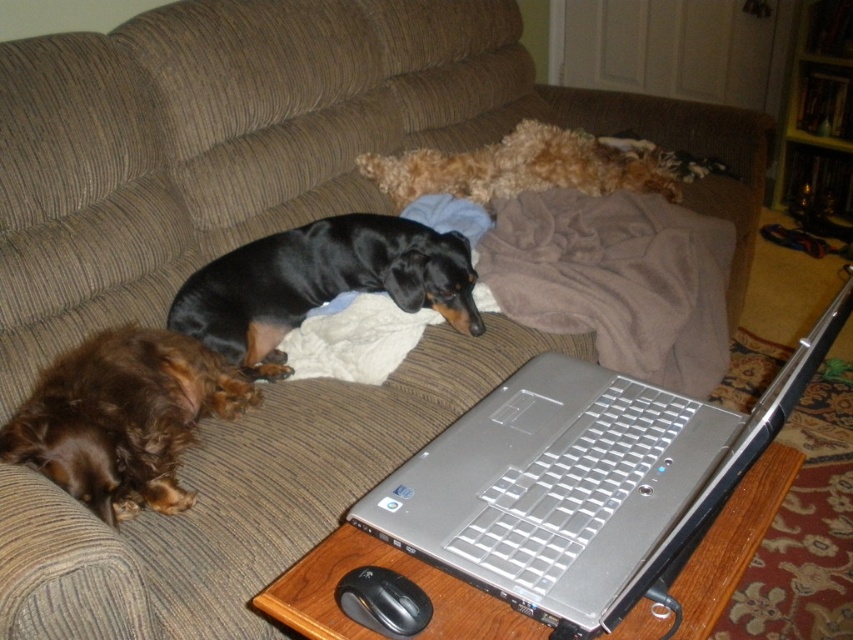
Question: Among these objects, which one is nearest to the camera?

Choices:
 (A) silver metallic laptop at center
 (B) brown soft blanket at center
 (C) black smooth dog at center
 (D) fuzzy brown dog at upper center

Answer: (A)

Question: Estimate the real-world distances between objects in this image. Which object is farther from the brown soft blanket at center?

Choices:
 (A) fuzzy brown dog at upper center
 (B) black smooth dog at center
 (C) brown furry dog at lower left

Answer: (C)

Question: Which point appears closest to the camera in this image?

Choices:
 (A) (461, 154)
 (B) (77, 499)
 (C) (712, 356)
 (D) (543, 499)

Answer: (D)

Question: Is silver metallic laptop at center below fuzzy brown dog at upper center?

Choices:
 (A) yes
 (B) no

Answer: (A)

Question: Considering the relative positions of silver metallic laptop at center and brown furry dog at lower left in the image provided, where is silver metallic laptop at center located with respect to brown furry dog at lower left?

Choices:
 (A) right
 (B) left

Answer: (A)

Question: Can you confirm if brown soft blanket at center is positioned above black smooth dog at center?

Choices:
 (A) no
 (B) yes

Answer: (B)